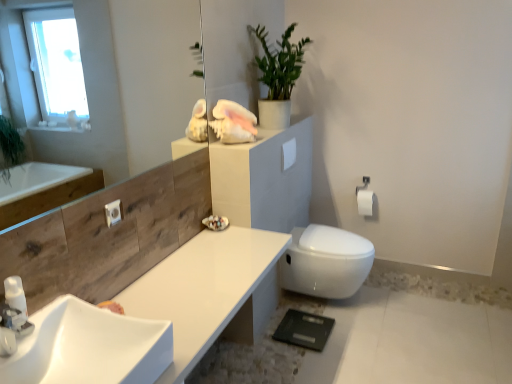
Find the location of a particular element. The width and height of the screenshot is (512, 384). free space in front of white glossy bidet at lower right is located at coordinates (371, 350).